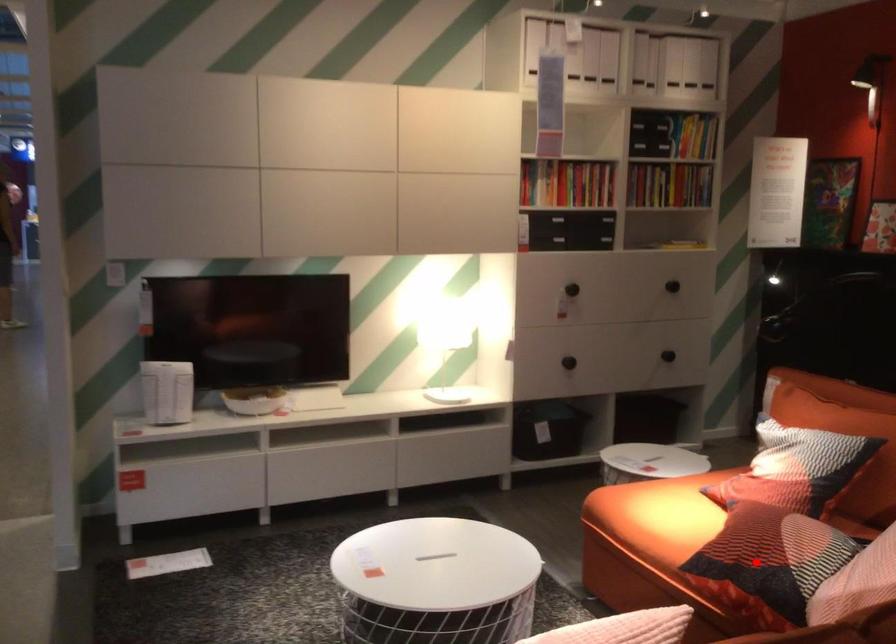
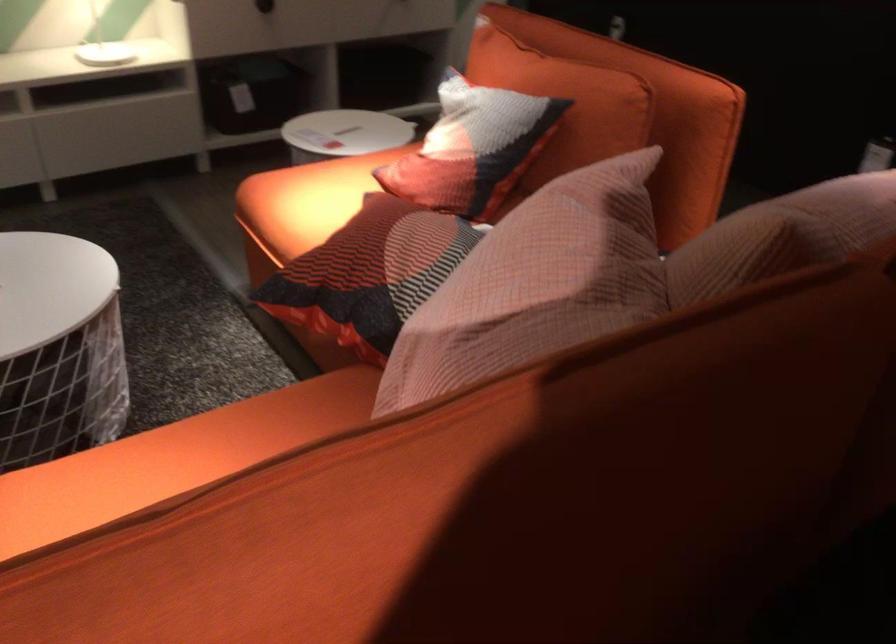
Question: I am providing you with two images of the same scene from different viewpoints. Image1 has a red point marked. In image2, the corresponding 3D location appears at what relative position? Reply with the corresponding letter.

Choices:
 (A) Closer
 (B) Farther

Answer: (A)